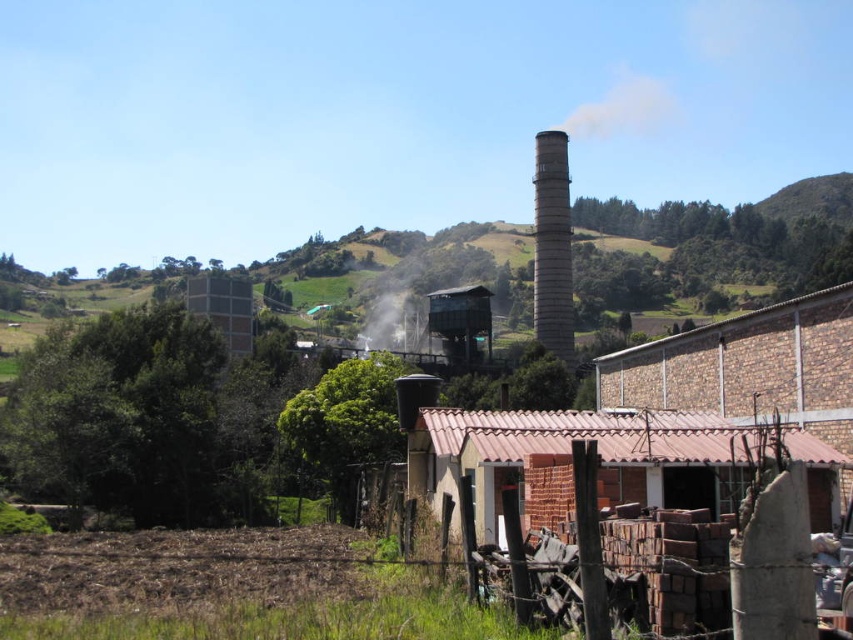
You are a drone operator flying a drone over the rural landscape. Your drone is currently at point (397, 307). You need to avoid any obstacles in the area. Is there any object at your current position that you should be aware of?

Yes, there is white translucent smoke at center located at point (397, 307), so you should be aware of it.

You are a drone operator tasked with inspecting the gray concrete chimney at upper center. Your drone has a maximum flight range of 100 meters. From your current position at the point marked by coordinates point (552, 246), can you reach the gray concrete chimney at upper center without exceeding the flight range?

The point marked by coordinates point (552, 246) is the location of the gray concrete chimney at upper center. Since the drone is already at the chimney, it doesn not need to travel any distance, so it can inspect the chimney without exceeding the flight range.